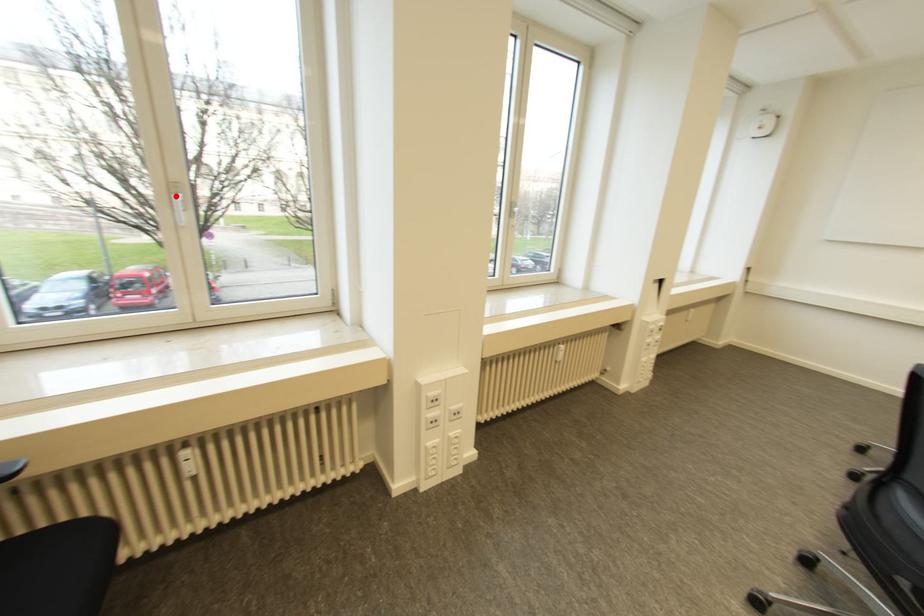
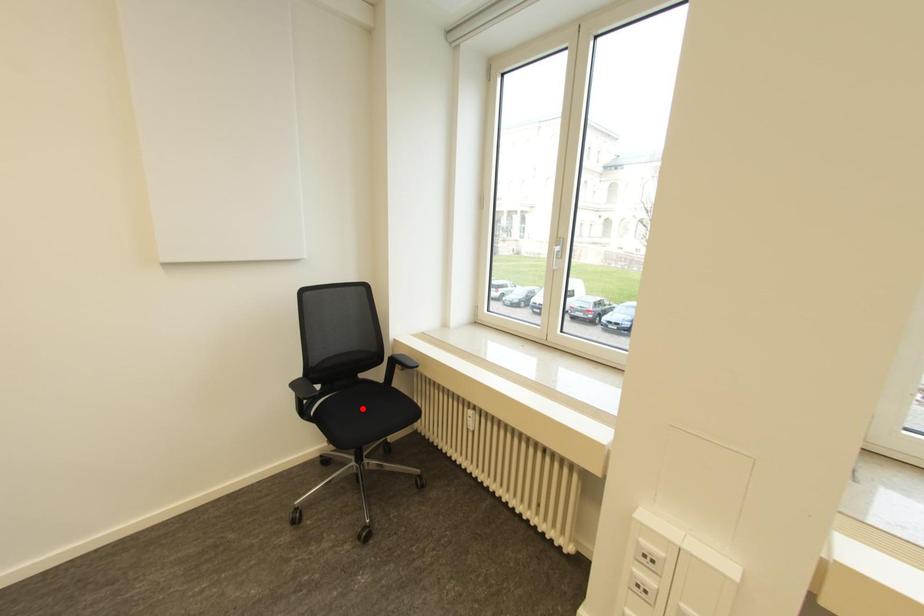
I am providing you with two images of the same scene from different viewpoints. A red point is marked on the first image and another point is marked on the second image. Are the points marked in image1 and image2 representing the same 3D position?

No